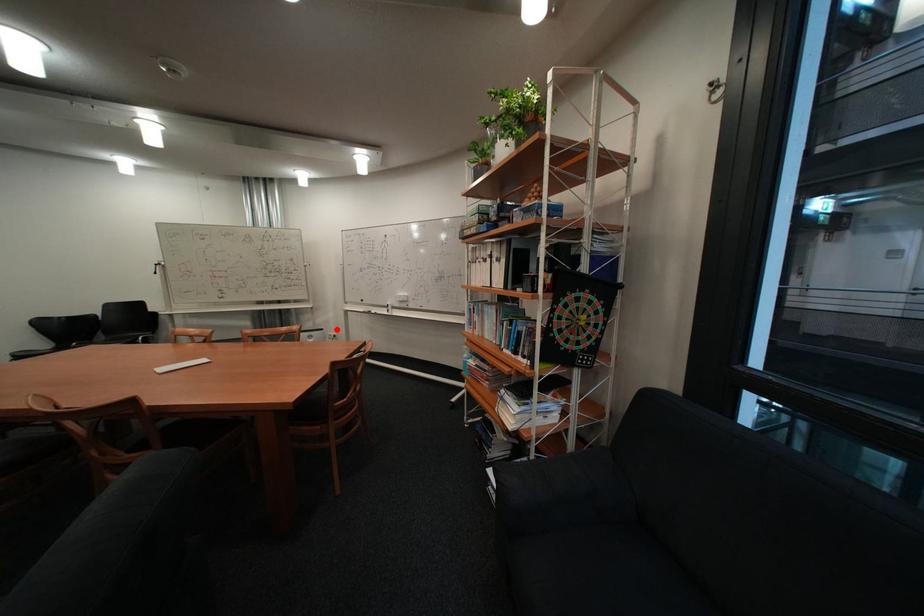
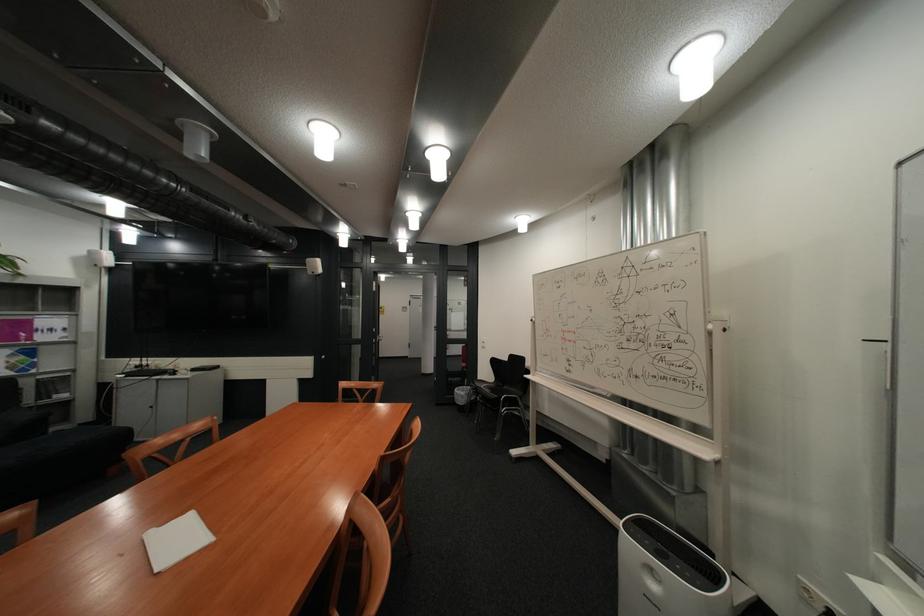
Question: A red point is marked in image1. In image2, is the corresponding 3D point closer to the camera or farther? Reply with the corresponding letter.

Choices:
 (A) The corresponding 3D point is closer.
 (B) The corresponding 3D point is farther.

Answer: (A)